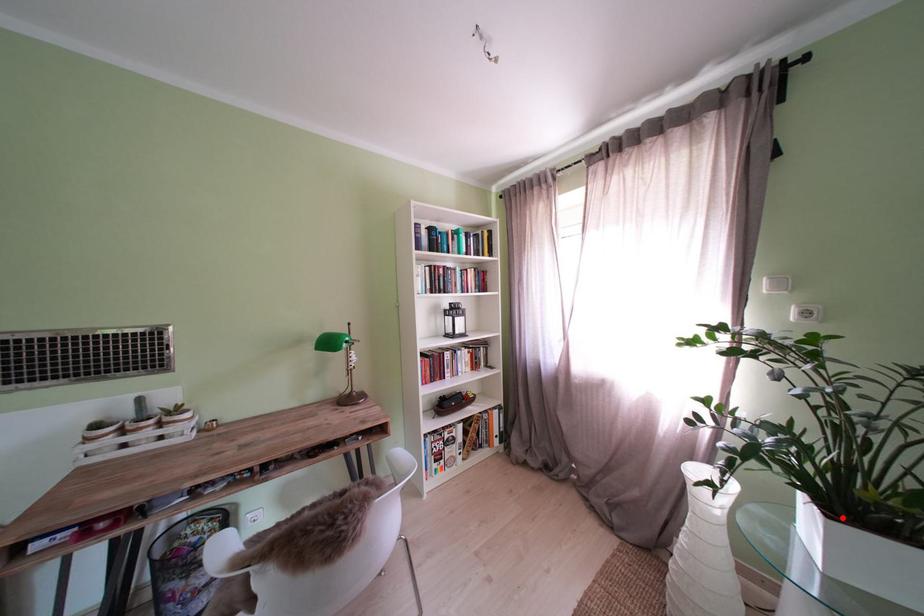
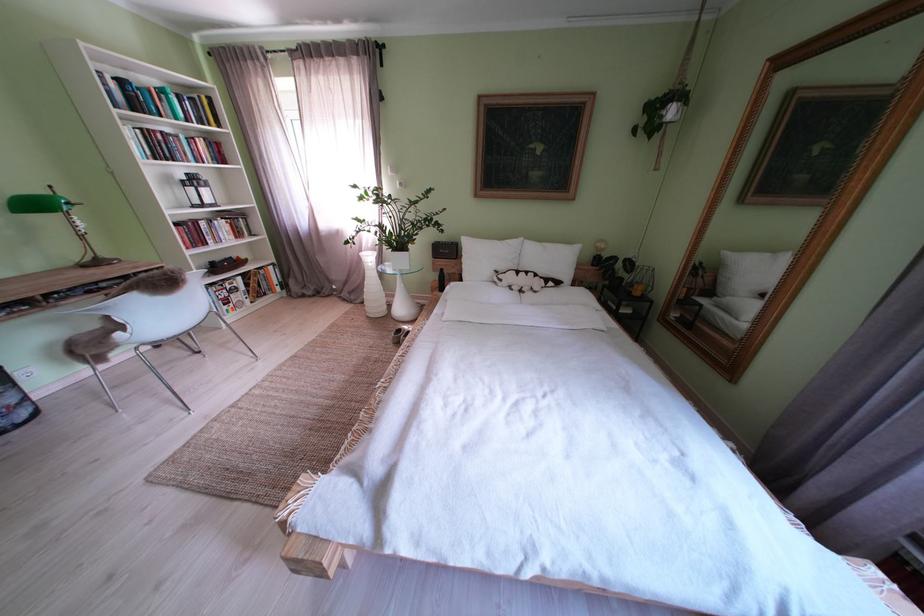
Question: I am providing you with two images of the same scene from different viewpoints. A red point is marked on the first image. Is the red point's position out of view in image 2?

Choices:
 (A) Yes
 (B) No

Answer: (B)